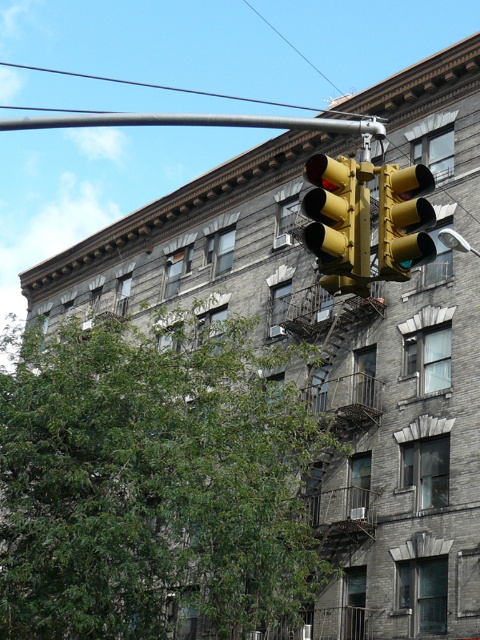
You are standing at the base of the building and looking up. There is a point marked at coordinates (338, 221). What object is located at that point?

The yellow matte traffic light at upper center is located at point (338, 221).

You are standing at the entrance of the multi story building and want to reach the traffic light. Based on the metallic gray pole at upper center, which direction should you head towards?

The metallic gray pole at upper center is located at point [194,122], so you should head towards the upper center direction to reach the traffic light.

You are a city planner assessing the building facade. You notice the metallic gray pole at upper center and the yellow metallic street light at upper center. Which object might require more space in terms of width when installing?

The metallic gray pole at upper center might require more space in terms of width when installing since it is wider than the yellow metallic street light at upper center according to the description.